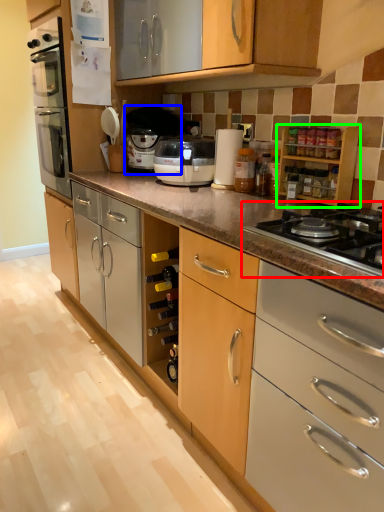
Question: Considering the real-world distances, which object is farthest from gas stove (highlighted by a red box)? coffee machine (highlighted by a blue box) or cabinetry (highlighted by a green box)?

Choices:
 (A) coffee machine
 (B) cabinetry

Answer: (A)